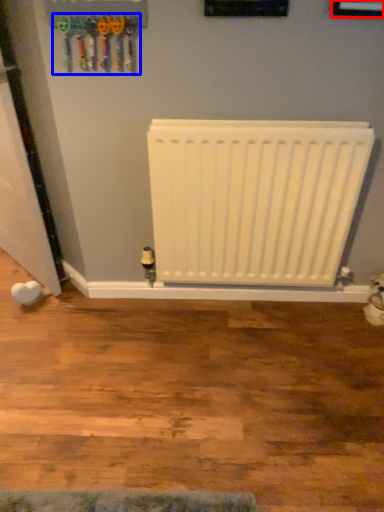
Question: Which of the following is the farthest to the observer, picture frame (highlighted by a red box) or tool (highlighted by a blue box)?

Choices:
 (A) picture frame
 (B) tool

Answer: (B)